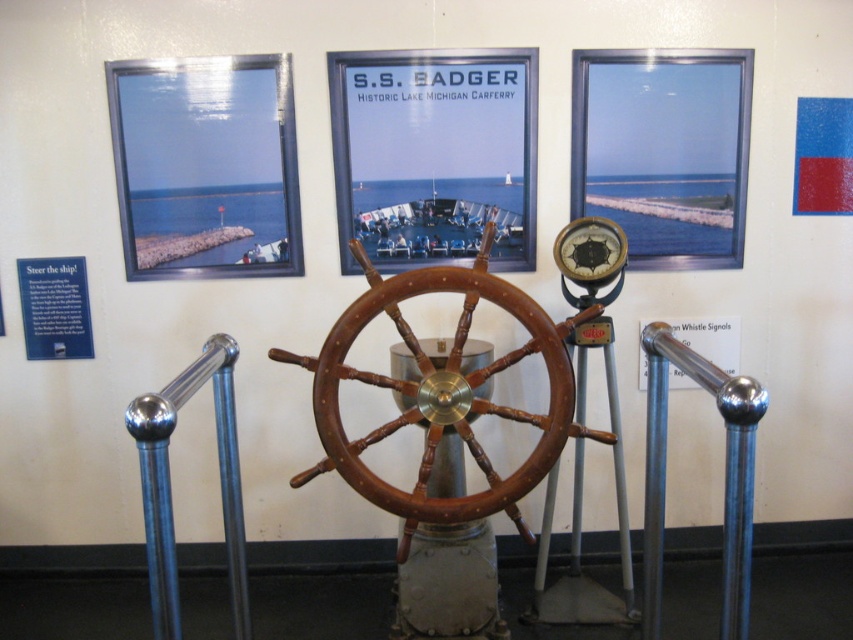
You are a museum guide who needs to place a 10 inch wide decorative plate between the brown polished wood at center and the matte black gauge at center. Can the plate fit between them without overlapping either object?

The brown polished wood at center and matte black gauge at center are 20.65 inches apart. Since the plate is only 10 inches wide, there is sufficient space between them to place the plate without overlapping either object.

From the picture: You are a museum visitor who wants to take a photo of the brown polished wood at center and the matte black gauge at center. Which object should you focus on first if you want to capture both in a single frame without moving the camera?

You should focus on the brown polished wood at center first because it is wider than the matte black gauge at center, so it will occupy more space in the frame.

You are a museum visitor who wants to take a photo of the brown polished wood at center and the polished metal pole at center. Which object should you focus on first if you want to capture both in a single frame without moving the camera?

You should focus on the brown polished wood at center first since it is larger in size compared to the polished metal pole at center, making it the primary subject to ensure it fits well in the frame.